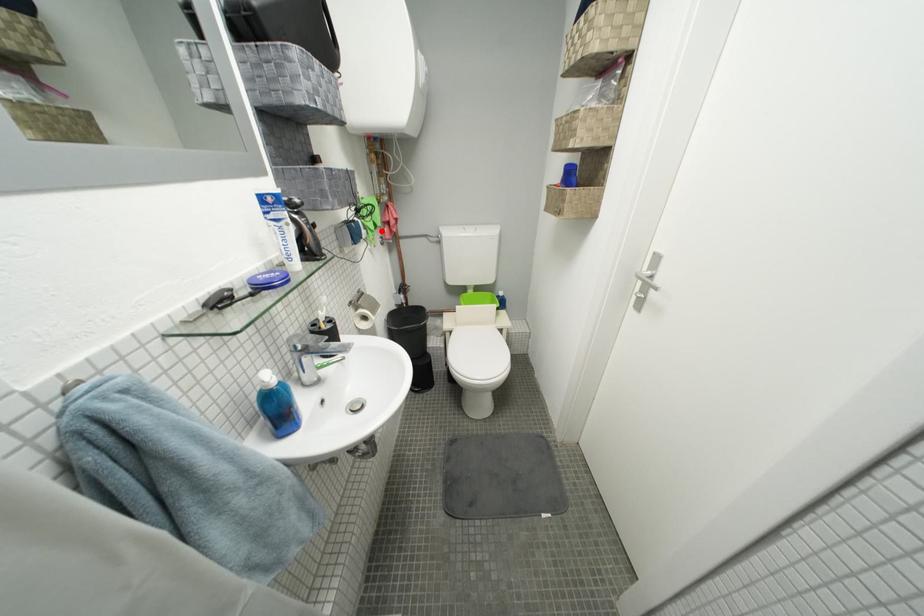
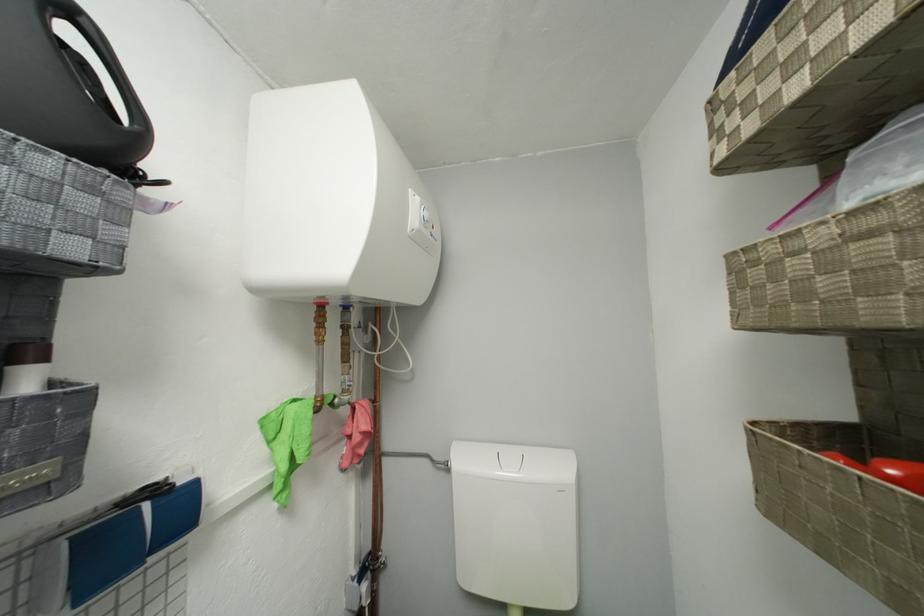
Question: I am providing you with two images of the same scene from different viewpoints. Given a red point in image1, look at the same physical point in image2. Is it:

Choices:
 (A) Closer to the viewpoint
 (B) Farther from the viewpoint

Answer: (B)